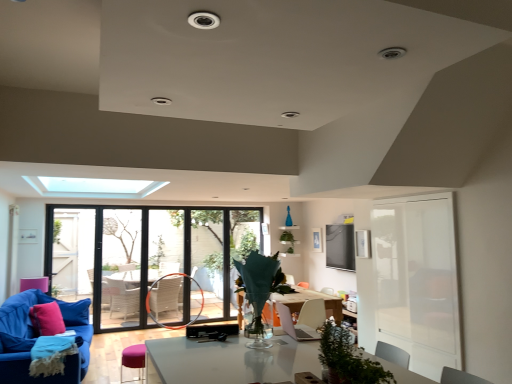
Question: Considering their positions, is purple fabric stool at lower left located in front of or behind green matte plant at center?

Choices:
 (A) front
 (B) behind

Answer: (A)

Question: Looking at their shapes, would you say purple fabric stool at lower left is wider or thinner than green matte plant at center?

Choices:
 (A) wide
 (B) thin

Answer: (A)

Question: Which of these objects is positioned farthest from the white translucent screen door at right?

Choices:
 (A) pink fabric pillow at lower left
 (B) clear glass window at center
 (C) purple fabric stool at lower left
 (D) velvet blue couch at lower left
 (E) green matte plant at center

Answer: (A)

Question: Based on their relative distances, which object is nearer to the white translucent screen door at right?

Choices:
 (A) clear glass window at center
 (B) green matte plant at center
 (C) purple fabric stool at lower left
 (D) pink fabric pillow at lower left
 (E) velvet blue couch at lower left

Answer: (C)